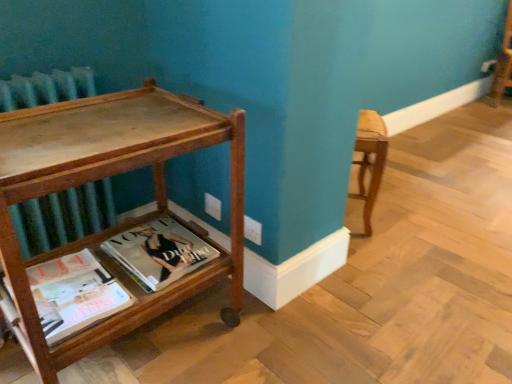
The width and height of the screenshot is (512, 384). What are the coordinates of `vacant space situated above matte paper magazine at lower left, the second book from the back (from a real-world perspective)` in the screenshot? It's located at (56, 287).